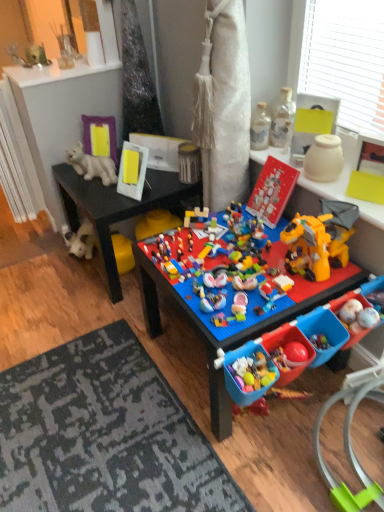
The height and width of the screenshot is (512, 384). Identify the location of free space that is to the left of black matte desk at center. (44, 287).